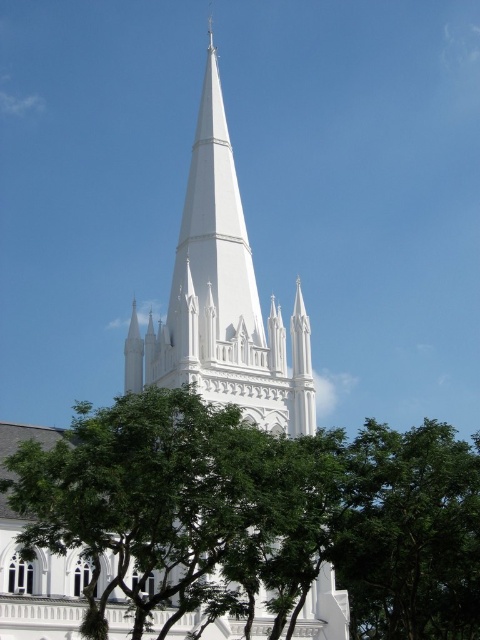
Question: Is green leafy tree at lower right positioned behind white smooth spire at center?

Choices:
 (A) no
 (B) yes

Answer: (A)

Question: In this image, where is white stone church steeple at center located relative to white smooth spire at center?

Choices:
 (A) below
 (B) above

Answer: (A)

Question: Which object is positioned farthest from the white stone church steeple at center?

Choices:
 (A) green leafy tree at lower right
 (B) white smooth spire at center
 (C) green leafy tree at lower left
 (D) white smooth steeple at center

Answer: (A)

Question: Which point is closer to the camera?

Choices:
 (A) white stone church steeple at center
 (B) white smooth steeple at center
 (C) green leafy tree at lower left

Answer: (C)

Question: Which point is farther to the camera?

Choices:
 (A) white smooth steeple at center
 (B) white stone church steeple at center
 (C) green leafy tree at lower right
 (D) white smooth spire at center

Answer: (D)

Question: Can you confirm if green leafy tree at lower left is smaller than white stone church steeple at center?

Choices:
 (A) yes
 (B) no

Answer: (A)